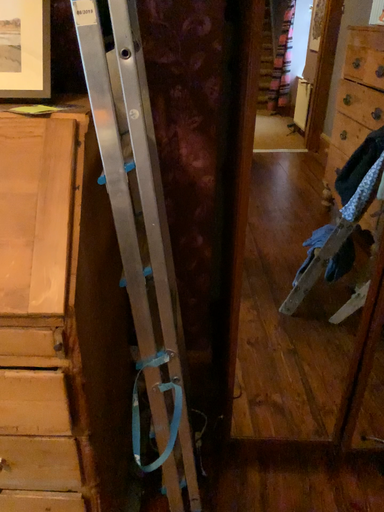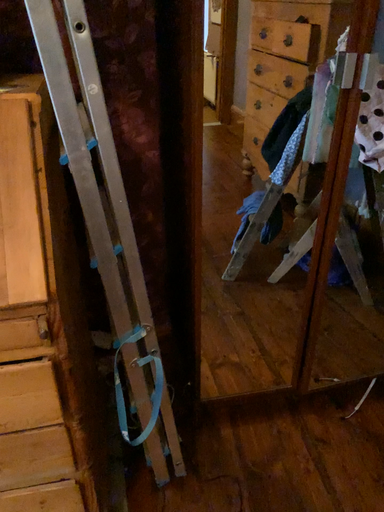
Question: Which way did the camera rotate in the video?

Choices:
 (A) rotated left
 (B) rotated right

Answer: (B)